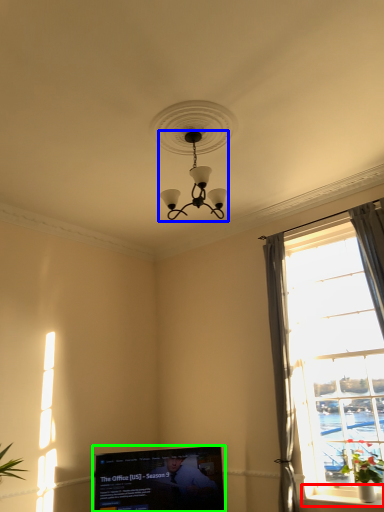
Question: Based on their relative distances, which object is farther from window sill (highlighted by a red box)? Choose from lamp (highlighted by a blue box) and television (highlighted by a green box).

Choices:
 (A) lamp
 (B) television

Answer: (A)